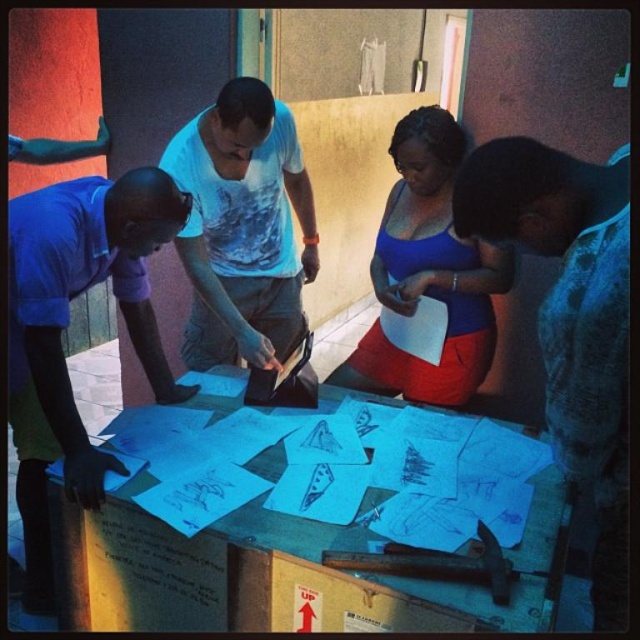
Does purple matte shirt at left have a greater height compared to white printed t-shirt at center?

Yes, purple matte shirt at left is taller than white printed t-shirt at center.

From the picture: Can you confirm if purple matte shirt at left is positioned to the left of white printed t-shirt at center?

Yes, purple matte shirt at left is to the left of white printed t-shirt at center.

What are the coordinates of `purple matte shirt at left` in the screenshot? It's located at (67, 324).

At what (x,y) coordinates should I click in order to perform the action: click on purple matte shirt at left. Please return your answer as a coordinate pair (x, y). This screenshot has height=640, width=640. Looking at the image, I should click on (67, 324).

Between point (564, 308) and point (417, 237), which one is positioned behind?

The point (417, 237) is behind.

How far apart are matte blue shirt at lower right and blue fabric top at center?

The distance of matte blue shirt at lower right from blue fabric top at center is 28.18 inches.

Does point (525, 150) come in front of point (435, 115)?

Yes, point (525, 150) is closer to viewer.

The width and height of the screenshot is (640, 640). In order to click on matte blue shirt at lower right in this screenshot , I will do `click(572, 320)`.

How much distance is there between blue fabric top at center and white paper at center?

blue fabric top at center and white paper at center are 7.06 feet apart.

Does blue fabric top at center have a lesser height compared to white paper at center?

No, blue fabric top at center is not shorter than white paper at center.

Where is `blue fabric top at center`? blue fabric top at center is located at coordinates (428, 273).

Identify the location of blue fabric top at center. (428, 273).